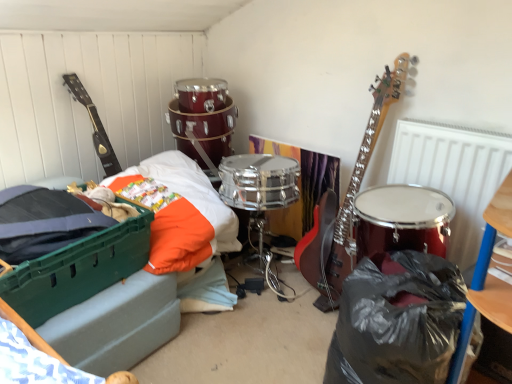
Question: Would you say metallic silver radiator at upper right contains black plastic bag at lower right?

Choices:
 (A) yes
 (B) no

Answer: (B)

Question: Is metallic silver radiator at upper right to the left of black plastic bag at lower right from the viewer's perspective?

Choices:
 (A) no
 (B) yes

Answer: (B)

Question: From a real-world perspective, is metallic silver radiator at upper right positioned over black plastic bag at lower right based on gravity?

Choices:
 (A) no
 (B) yes

Answer: (B)

Question: Is metallic silver radiator at upper right closer to the viewer compared to black plastic bag at lower right?

Choices:
 (A) no
 (B) yes

Answer: (A)

Question: Is metallic silver radiator at upper right oriented away from black plastic bag at lower right?

Choices:
 (A) yes
 (B) no

Answer: (B)

Question: From a real-world perspective, is metallic silver radiator at upper right located beneath black plastic bag at lower right?

Choices:
 (A) no
 (B) yes

Answer: (A)

Question: From the image's perspective, would you say matte black guitar at left is shown under metallic silver radiator at upper right?

Choices:
 (A) yes
 (B) no

Answer: (B)

Question: Is the surface of matte black guitar at left in direct contact with metallic silver radiator at upper right?

Choices:
 (A) no
 (B) yes

Answer: (A)

Question: Is matte black guitar at left bigger than metallic silver radiator at upper right?

Choices:
 (A) no
 (B) yes

Answer: (A)

Question: From a real-world perspective, is matte black guitar at left on metallic silver radiator at upper right?

Choices:
 (A) no
 (B) yes

Answer: (B)

Question: Can you confirm if matte black guitar at left is wider than metallic silver radiator at upper right?

Choices:
 (A) no
 (B) yes

Answer: (B)

Question: Could you tell me if matte black guitar at left is turned towards metallic silver radiator at upper right?

Choices:
 (A) yes
 (B) no

Answer: (B)

Question: Does black plastic bag at lower right lie in front of black plastic bag at lower right?

Choices:
 (A) no
 (B) yes

Answer: (A)